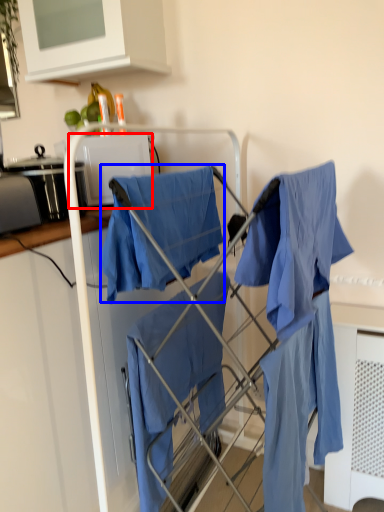
Question: Which object is further to the camera taking this photo, appliance (highlighted by a red box) or cloak (highlighted by a blue box)?

Choices:
 (A) appliance
 (B) cloak

Answer: (A)